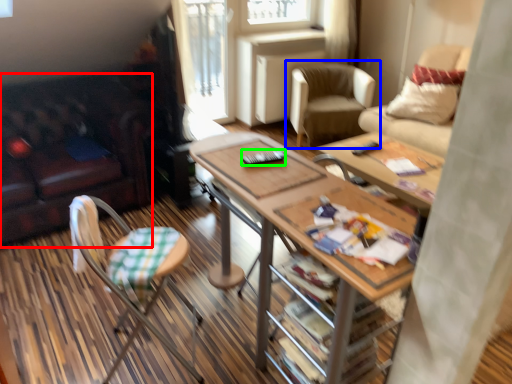
Question: Based on their relative distances, which object is farther from studio couch (highlighted by a red box)? Choose from chair (highlighted by a blue box) and remote control (highlighted by a green box).

Choices:
 (A) chair
 (B) remote control

Answer: (A)